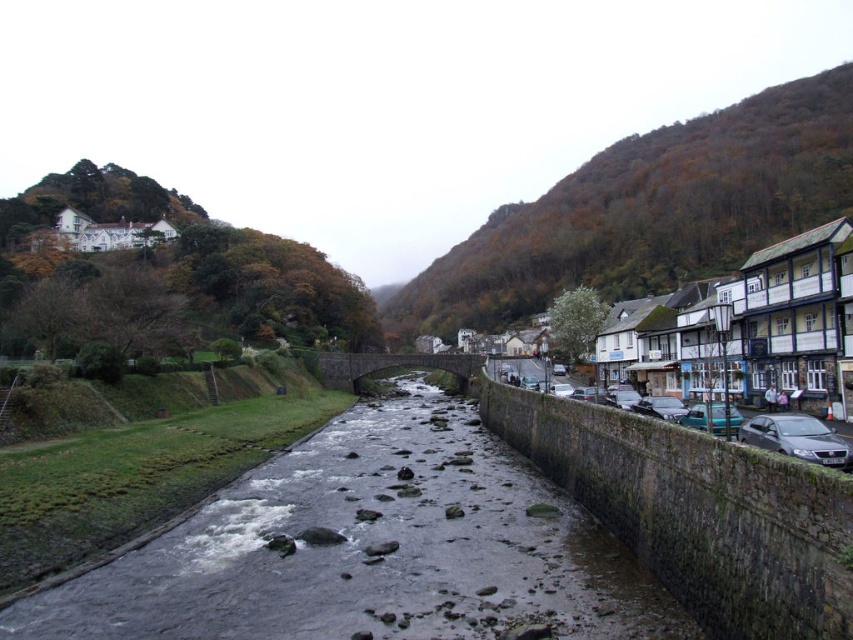
Question: Is smooth concrete river at center above green leafy hillside at upper right?

Choices:
 (A) no
 (B) yes

Answer: (A)

Question: Among these points, which one is farthest from the camera?

Choices:
 (A) (830, 444)
 (B) (419, 496)
 (C) (125, 241)

Answer: (C)

Question: Can you confirm if metallic gray car at right is positioned to the left of white wooden house at upper left?

Choices:
 (A) yes
 (B) no

Answer: (B)

Question: Does metallic gray car at right have a smaller size compared to white wooden house at upper left?

Choices:
 (A) yes
 (B) no

Answer: (A)

Question: Which of the following is the farthest from the observer?

Choices:
 (A) (563, 234)
 (B) (831, 444)
 (C) (91, 225)
 (D) (366, 504)

Answer: (A)

Question: Based on their relative distances, which object is farther from the metallic gray sedan at right?

Choices:
 (A) white wooden house at upper left
 (B) smooth concrete river at center
 (C) green leafy hillside at upper right
 (D) metallic gray car at right

Answer: (C)